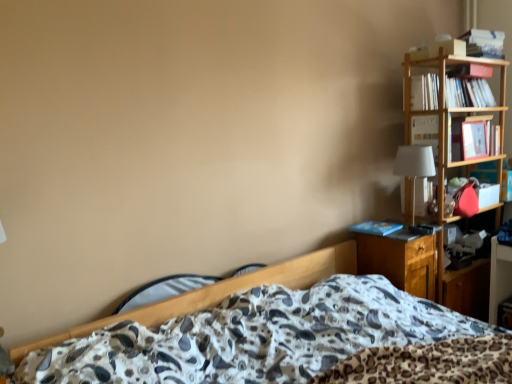
Question: Considering the relative positions of wooden nightstand at right and hardcover book at upper right, the 3th book when ordered from top to bottom, in the image provided, is wooden nightstand at right to the left or to the right of hardcover book at upper right, the 3th book when ordered from top to bottom,?

Choices:
 (A) left
 (B) right

Answer: (A)

Question: Which is correct: wooden nightstand at right is inside hardcover book at upper right, the 2th book positioned from the bottom, or outside of it?

Choices:
 (A) outside
 (B) inside

Answer: (A)

Question: Which of these objects is positioned farthest from the hardcover book at upper right, which appears as the fourth book when ordered from the bottom?

Choices:
 (A) blue matte book at right, the 4th book when ordered from top to bottom
 (B) wooden nightstand at right
 (C) white paper book at upper right, marked as the 2th book in a top-to-bottom arrangement
 (D) white fabric lampshade at right
 (E) hardcover book at upper right, the 2th book positioned from the bottom

Answer: (B)

Question: Which of these objects is positioned closest to the hardcover book at upper right, which appears as the fourth book when ordered from the bottom?

Choices:
 (A) wooden nightstand at right
 (B) blue matte book at right, the 4th book when ordered from top to bottom
 (C) hardcover book at upper right, the 2th book positioned from the bottom
 (D) white paper book at upper right, the 3th book ordered from the bottom
 (E) white fabric lampshade at right

Answer: (D)